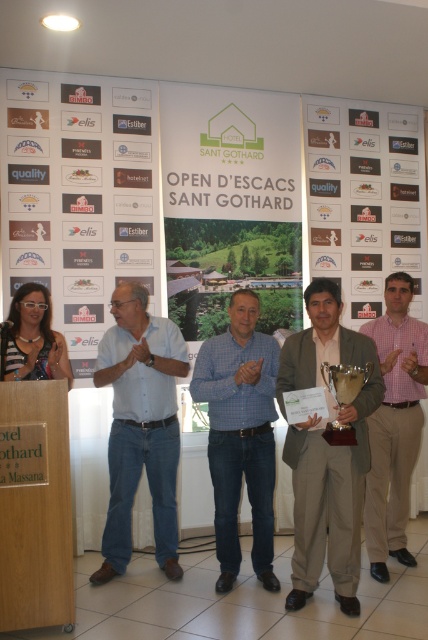
Is point (64, 90) closer to viewer compared to point (347, 428)?

No.

Is white paper poster at left in front of gold metallic trophy at center?

No, it is not.

The height and width of the screenshot is (640, 428). Find the location of `white paper poster at left`. white paper poster at left is located at coordinates (80, 196).

Is matte brown suit at center above gold metallic trophy at center?

Actually, matte brown suit at center is below gold metallic trophy at center.

Is point (327, 566) positioned before point (326, 428)?

No.

Where is `matte brown suit at center`? matte brown suit at center is located at coordinates (326, 451).

Between white paper poster at left and blue jeans at center, which one is positioned higher?

white paper poster at left is higher up.

Does white paper poster at left appear under blue jeans at center?

Actually, white paper poster at left is above blue jeans at center.

Is point (107, 192) less distant than point (109, 330)?

No, it is behind (109, 330).

At what (x,y) coordinates should I click in order to perform the action: click on white paper poster at left. Please return your answer as a coordinate pair (x, y). Image resolution: width=428 pixels, height=640 pixels. Looking at the image, I should click on (80, 196).